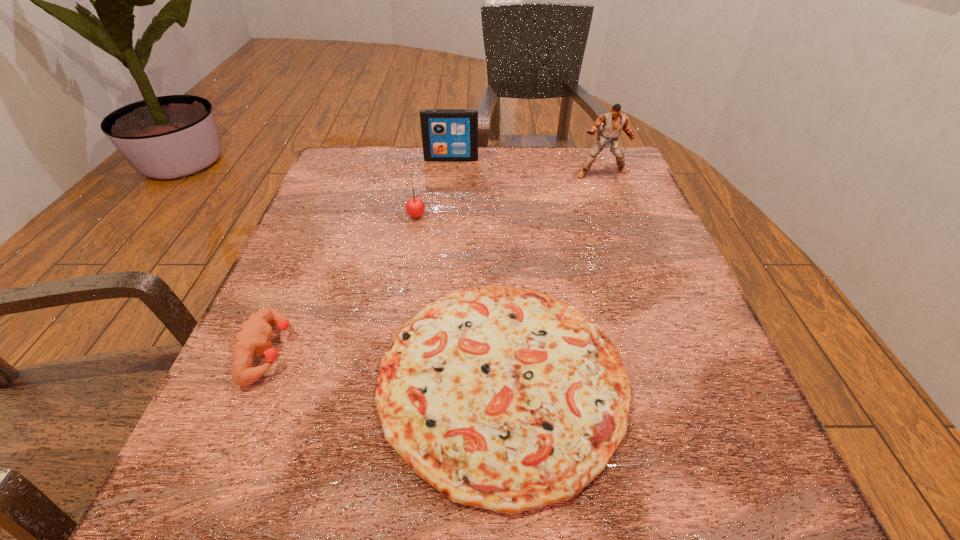
Where is `free area in between the shorter puncher and the third nearest object`? The width and height of the screenshot is (960, 540). free area in between the shorter puncher and the third nearest object is located at coordinates (343, 283).

I want to click on unoccupied position between the tallest object and the pizza, so click(552, 276).

Where is `free spot between the pizza and the rightmost object`? Image resolution: width=960 pixels, height=540 pixels. free spot between the pizza and the rightmost object is located at coordinates pyautogui.click(x=552, y=276).

Find the location of a particular element. This screenshot has width=960, height=540. empty location between the third nearest object and the farthest object is located at coordinates (434, 187).

You are a GUI agent. You are given a task and a screenshot of the screen. Output one action in this format:
    pyautogui.click(x=<x>, y=<y>)
    Task: Click on the free space between the leftmost object and the second tallest object
    The width and height of the screenshot is (960, 540).
    Given the screenshot: What is the action you would take?
    pyautogui.click(x=360, y=255)

This screenshot has width=960, height=540. Find the location of `free space between the cherry and the farthest object`. free space between the cherry and the farthest object is located at coordinates (434, 187).

Identify which object is the fourth nearest to the pizza. Please provide its 2D coordinates. Your answer should be formatted as a tuple, i.e. [(x, y)], where the tuple contains the x and y coordinates of a point satisfying the conditions above.

[(447, 134)]

Locate an element on the screen. object that is the fourth closest to the second tallest object is located at coordinates (253, 337).

This screenshot has height=540, width=960. What are the coordinates of `vacant region that satisfies the following two spatial constraints: 1. on the front side of the third shortest object; 2. on the right side of the pizza` in the screenshot? It's located at (388, 380).

The image size is (960, 540). I want to click on free location that satisfies the following two spatial constraints: 1. with the gloves of the nearer puncher facing forward; 2. on the back side of the pizza, so click(256, 380).